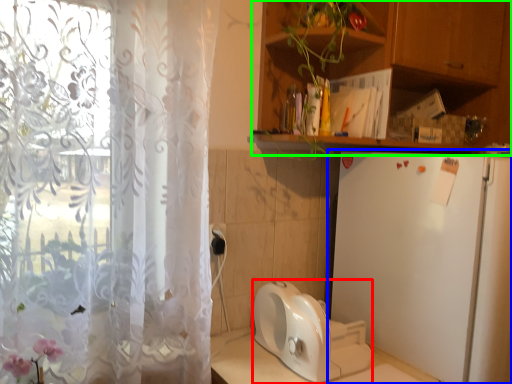
Question: Considering the real-world distances, which object is farthest from appliance (highlighted by a red box)? refrigerator (highlighted by a blue box) or cabinetry (highlighted by a green box)?

Choices:
 (A) refrigerator
 (B) cabinetry

Answer: (B)